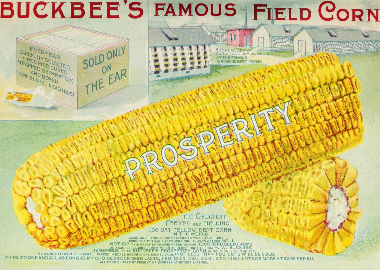
Where is `boxes`? This screenshot has width=380, height=270. boxes is located at coordinates (68, 72).